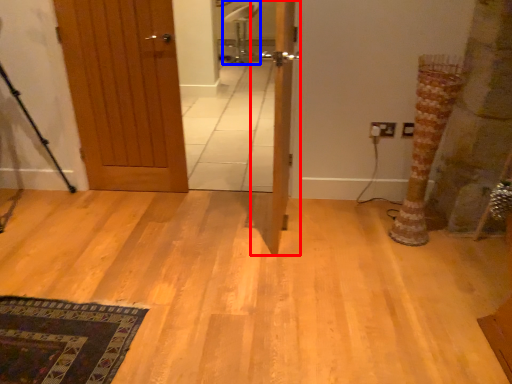
Question: Which of the following is the closest to the observer, door (highlighted by a red box) or chair (highlighted by a blue box)?

Choices:
 (A) door
 (B) chair

Answer: (A)